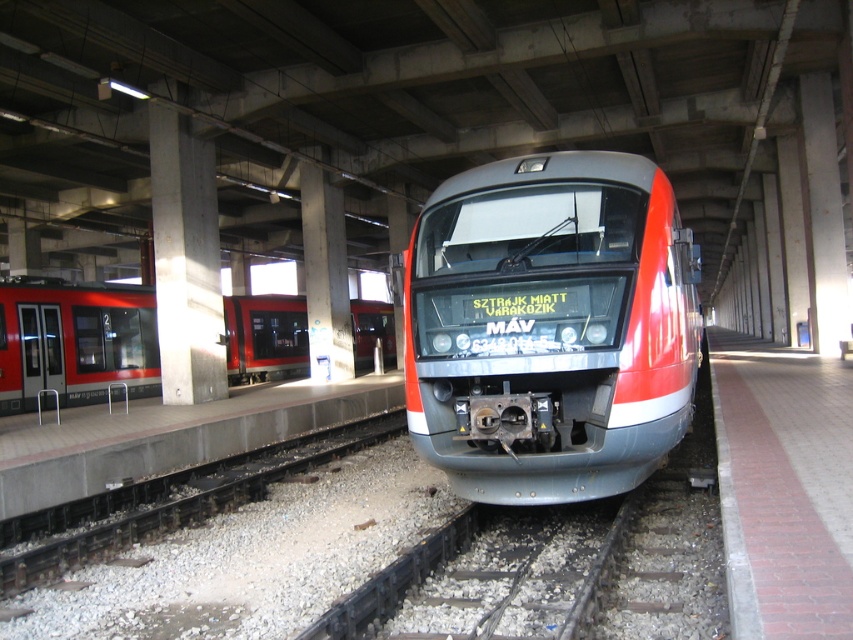
Which of these two, metallic gray train at center or matte red train at left, stands shorter?

With less height is matte red train at left.

Find the location of a particular element. The height and width of the screenshot is (640, 853). metallic gray train at center is located at coordinates (549, 326).

The image size is (853, 640). What do you see at coordinates (549, 326) in the screenshot? I see `metallic gray train at center` at bounding box center [549, 326].

Identify the location of metallic gray train at center. (549, 326).